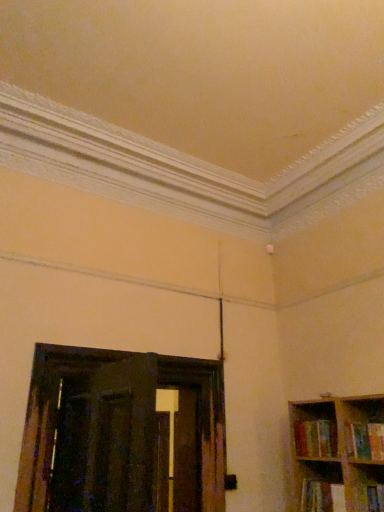
Question: Is the depth of multicolored paperbacks at right, the second book when ordered from bottom to top, greater than that of multicolored fabric book at lower right, which appears as the third book when viewed from the top?

Choices:
 (A) yes
 (B) no

Answer: (A)

Question: Considering the relative positions of multicolored paperbacks at right, which is counted as the second book, starting from the top, and multicolored fabric book at lower right, which appears as the third book when viewed from the top, in the image provided, is multicolored paperbacks at right, which is counted as the second book, starting from the top, in front of multicolored fabric book at lower right, which appears as the third book when viewed from the top,?

Choices:
 (A) no
 (B) yes

Answer: (A)

Question: Are multicolored paperbacks at right, the second book when ordered from bottom to top, and multicolored fabric book at lower right, which appears as the third book when viewed from the top, making contact?

Choices:
 (A) yes
 (B) no

Answer: (B)

Question: From the image's perspective, is multicolored paperbacks at right, the second book when ordered from bottom to top, beneath multicolored fabric book at lower right, which appears as the third book when viewed from the top?

Choices:
 (A) yes
 (B) no

Answer: (B)

Question: Considering the relative sizes of multicolored paperbacks at right, which is counted as the second book, starting from the top, and multicolored fabric book at lower right, which appears as the third book when viewed from the top, in the image provided, is multicolored paperbacks at right, which is counted as the second book, starting from the top, taller than multicolored fabric book at lower right, which appears as the third book when viewed from the top,?

Choices:
 (A) no
 (B) yes

Answer: (B)

Question: Looking at the image, does hardcover book at right, which is the first book from top to bottom, seem bigger or smaller compared to multicolored fabric book at lower right, which appears as the third book when viewed from the top?

Choices:
 (A) big
 (B) small

Answer: (A)

Question: Considering the positions of hardcover book at right, acting as the 3th book starting from the bottom, and multicolored fabric book at lower right, the 1th book positioned from the bottom, in the image, is hardcover book at right, acting as the 3th book starting from the bottom, taller or shorter than multicolored fabric book at lower right, the 1th book positioned from the bottom,?

Choices:
 (A) tall
 (B) short

Answer: (A)

Question: From the image's perspective, is hardcover book at right, acting as the 3th book starting from the bottom, located above or below multicolored fabric book at lower right, the 1th book positioned from the bottom?

Choices:
 (A) above
 (B) below

Answer: (A)

Question: Relative to multicolored fabric book at lower right, which appears as the third book when viewed from the top, is hardcover book at right, which is the first book from top to bottom, in front or behind?

Choices:
 (A) behind
 (B) front

Answer: (B)

Question: Based on their sizes in the image, would you say multicolored paperbacks at right, the second book when ordered from bottom to top, is bigger or smaller than multicolored fabric book at lower right, the 1th book positioned from the bottom?

Choices:
 (A) small
 (B) big

Answer: (B)

Question: Is multicolored paperbacks at right, the second book when ordered from bottom to top, situated inside multicolored fabric book at lower right, the 1th book positioned from the bottom, or outside?

Choices:
 (A) inside
 (B) outside

Answer: (B)

Question: From a real-world perspective, is multicolored paperbacks at right, the second book when ordered from bottom to top, positioned above or below multicolored fabric book at lower right, which appears as the third book when viewed from the top?

Choices:
 (A) below
 (B) above

Answer: (B)

Question: Is multicolored paperbacks at right, which is counted as the second book, starting from the top, taller or shorter than multicolored fabric book at lower right, which appears as the third book when viewed from the top?

Choices:
 (A) tall
 (B) short

Answer: (A)

Question: Is point (309, 510) positioned closer to the camera than point (299, 444)?

Choices:
 (A) closer
 (B) farther

Answer: (A)

Question: Would you say multicolored fabric book at lower right, which appears as the third book when viewed from the top, is to the left or to the right of multicolored paperbacks at right, the second book when ordered from bottom to top, in the picture?

Choices:
 (A) right
 (B) left

Answer: (B)